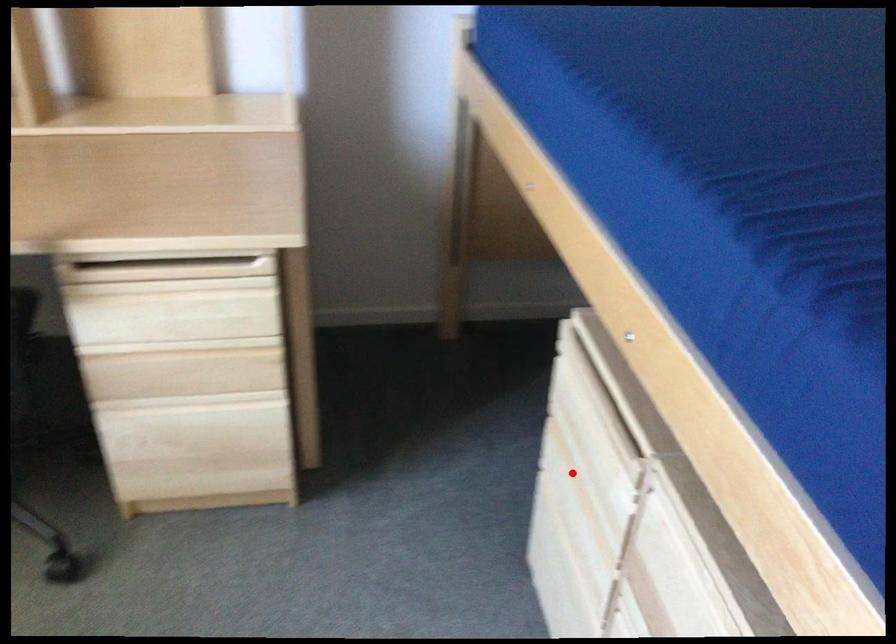
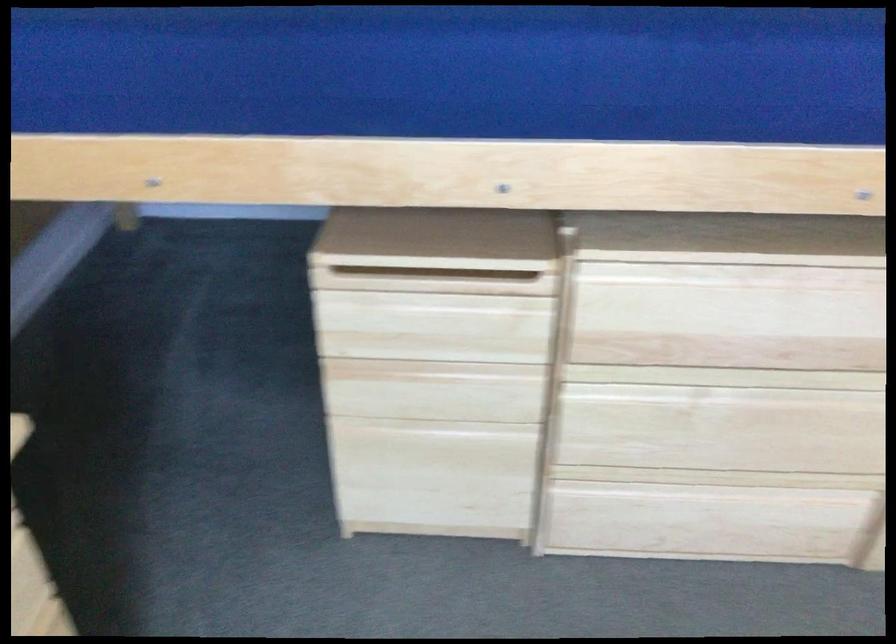
Question: I am providing you with two images of the same scene from different viewpoints. A red point is marked on the first image. Can you still see the location of the red point in image 2?

Choices:
 (A) Yes
 (B) No

Answer: (A)